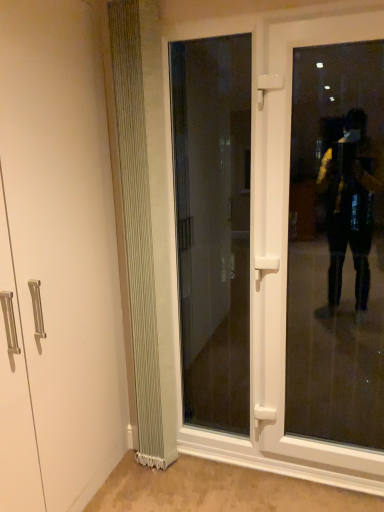
Question: Which direction should I rotate to look at transparent glass door at center, which appears as the 1th door when viewed from the left?

Choices:
 (A) left
 (B) right

Answer: (B)

Question: Is transparent glass door at right surrounded by white plastic door at center, placed as the second door when sorted from left to right?

Choices:
 (A) yes
 (B) no

Answer: (A)

Question: From the image's perspective, is white plastic door at center, placed as the second door when sorted from left to right, above transparent glass door at right?

Choices:
 (A) no
 (B) yes

Answer: (A)

Question: Is white plastic door at center, positioned as the 1th door in right-to-left order, positioned far away from transparent glass door at right?

Choices:
 (A) yes
 (B) no

Answer: (A)

Question: Is white plastic door at center, positioned as the 1th door in right-to-left order, positioned with its back to transparent glass door at right?

Choices:
 (A) yes
 (B) no

Answer: (A)

Question: Does white plastic door at center, placed as the second door when sorted from left to right, lie in front of transparent glass door at right?

Choices:
 (A) yes
 (B) no

Answer: (B)

Question: Is white plastic door at center, positioned as the 1th door in right-to-left order, bigger than transparent glass door at right?

Choices:
 (A) no
 (B) yes

Answer: (A)

Question: From a real-world perspective, does white ribbed radiator at left sit lower than transparent glass door at center, which appears as the 1th door when viewed from the left?

Choices:
 (A) no
 (B) yes

Answer: (A)

Question: Does white ribbed radiator at left turn towards transparent glass door at center, which appears as the 1th door when viewed from the left?

Choices:
 (A) yes
 (B) no

Answer: (B)

Question: Does white ribbed radiator at left have a greater height compared to transparent glass door at center, the 2th door positioned from the right?

Choices:
 (A) yes
 (B) no

Answer: (A)

Question: From the image's perspective, is white ribbed radiator at left on top of transparent glass door at center, which appears as the 1th door when viewed from the left?

Choices:
 (A) yes
 (B) no

Answer: (B)

Question: Considering the relative sizes of white ribbed radiator at left and transparent glass door at center, which appears as the 1th door when viewed from the left, in the image provided, is white ribbed radiator at left wider than transparent glass door at center, which appears as the 1th door when viewed from the left,?

Choices:
 (A) no
 (B) yes

Answer: (B)

Question: Considering the relative sizes of white ribbed radiator at left and transparent glass door at center, the 2th door positioned from the right, in the image provided, is white ribbed radiator at left bigger than transparent glass door at center, the 2th door positioned from the right,?

Choices:
 (A) no
 (B) yes

Answer: (B)

Question: From a real-world perspective, is transparent glass door at center, the 2th door positioned from the right, on top of transparent glass door at right?

Choices:
 (A) yes
 (B) no

Answer: (A)